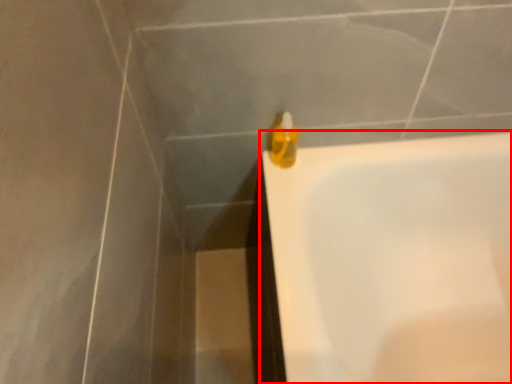
Question: Observing the image, what is the correct spatial positioning of bathtub (annotated by the red box) in reference to liquid?

Choices:
 (A) right
 (B) left

Answer: (A)